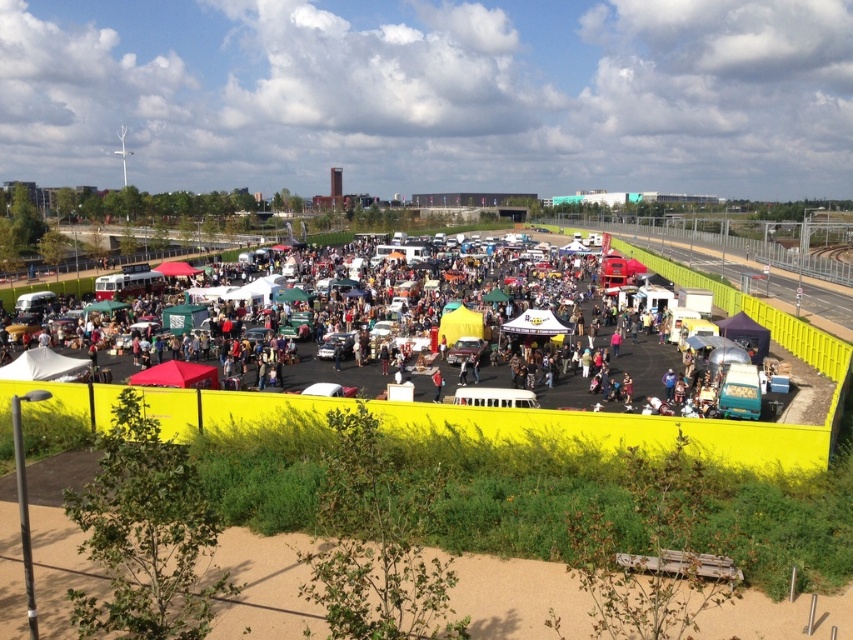
You are standing at the entrance of the market and want to find the matte red canopy at lower left. According to the coordinates given, where should you look?

The matte red canopy at lower left is located at point (177, 376).